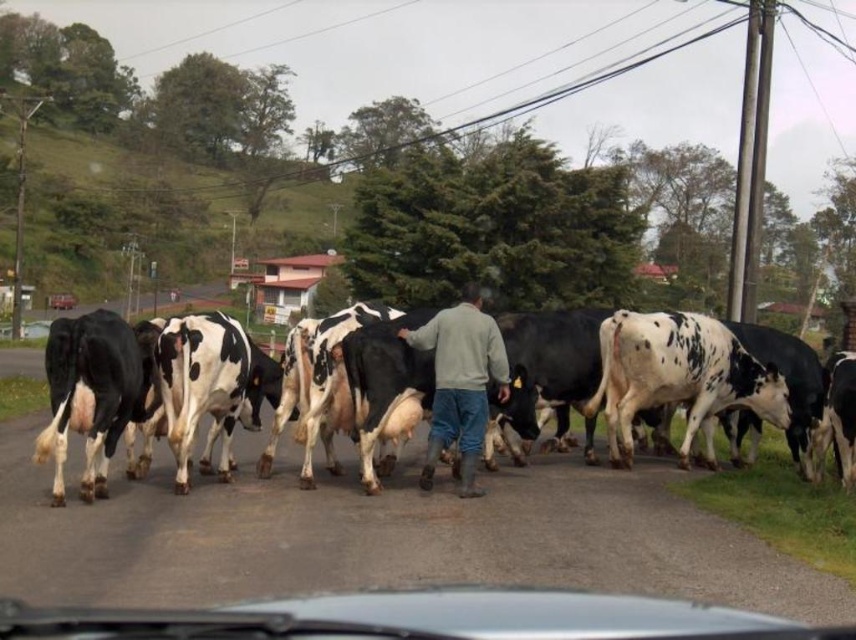
Question: From the image, what is the correct spatial relationship of black and white spotted cows at center in relation to gray fleece jacket at center?

Choices:
 (A) above
 (B) below

Answer: (B)

Question: Among these objects, which one is farthest from the camera?

Choices:
 (A) gray fleece jacket at center
 (B) metallic silver car at center

Answer: (B)

Question: Which point appears closest to the camera in this image?

Choices:
 (A) (450, 404)
 (B) (57, 300)

Answer: (A)

Question: Is gray fleece jacket at center bigger than metallic silver car at center?

Choices:
 (A) yes
 (B) no

Answer: (B)

Question: Which point is farther to the camera?

Choices:
 (A) (464, 288)
 (B) (391, 349)
 (C) (73, 298)
 (D) (587, 609)

Answer: (C)

Question: Is transparent glass windshield at center to the left of gray fleece jacket at center from the viewer's perspective?

Choices:
 (A) yes
 (B) no

Answer: (A)